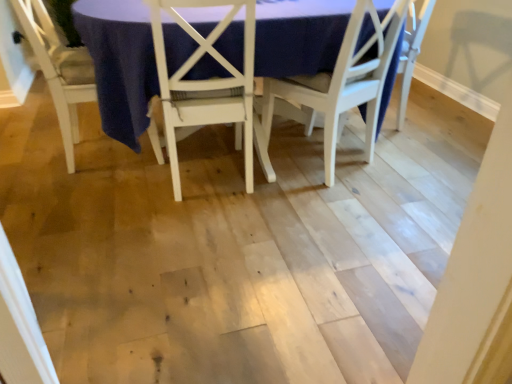
Question: Considering the relative sizes of white wood chair at center, placed as the 3th chair when sorted from left to right, and white wood chair at lower left, which is the 3th chair from right to left, in the image provided, is white wood chair at center, placed as the 3th chair when sorted from left to right, wider than white wood chair at lower left, which is the 3th chair from right to left,?

Choices:
 (A) no
 (B) yes

Answer: (A)

Question: Can you confirm if white wood chair at center, which appears as the 1th chair when viewed from the right, is thinner than white wood chair at lower left, which is the 3th chair from right to left?

Choices:
 (A) no
 (B) yes

Answer: (B)

Question: Does white wood chair at center, placed as the 3th chair when sorted from left to right, have a lesser height compared to white wood chair at lower left, which is the 3th chair from right to left?

Choices:
 (A) yes
 (B) no

Answer: (B)

Question: Is white wood chair at center, which appears as the 1th chair when viewed from the right, outside of white wood chair at lower left, marked as the 1th chair in a left-to-right arrangement?

Choices:
 (A) no
 (B) yes

Answer: (B)

Question: Could you tell me if white wood chair at center, placed as the 3th chair when sorted from left to right, is turned towards white wood chair at lower left, which is the 3th chair from right to left?

Choices:
 (A) no
 (B) yes

Answer: (A)

Question: From the image's perspective, relative to white wood chair at center, which appears as the 1th chair when viewed from the right, is matte white table at center above or below?

Choices:
 (A) below
 (B) above

Answer: (B)

Question: Is point (96, 71) closer or farther from the camera than point (352, 61)?

Choices:
 (A) closer
 (B) farther

Answer: (A)

Question: Is matte white table at center in front of or behind white wood chair at center, placed as the 3th chair when sorted from left to right, in the image?

Choices:
 (A) behind
 (B) front

Answer: (B)

Question: Choose the correct answer: Is matte white table at center inside white wood chair at center, placed as the 3th chair when sorted from left to right, or outside it?

Choices:
 (A) outside
 (B) inside

Answer: (A)

Question: Is white wood chair at center, which is the second chair in right-to-left order, to the left or to the right of white wood chair at lower left, marked as the 1th chair in a left-to-right arrangement, in the image?

Choices:
 (A) left
 (B) right

Answer: (B)

Question: From the image's perspective, is white wood chair at center, which is the second chair in right-to-left order, located above or below white wood chair at lower left, marked as the 1th chair in a left-to-right arrangement?

Choices:
 (A) below
 (B) above

Answer: (A)

Question: From a real-world perspective, is white wood chair at center, the 2th chair in the left-to-right sequence, physically located above or below white wood chair at lower left, which is the 3th chair from right to left?

Choices:
 (A) above
 (B) below

Answer: (A)

Question: In terms of height, does white wood chair at center, the 2th chair in the left-to-right sequence, look taller or shorter compared to white wood chair at lower left, which is the 3th chair from right to left?

Choices:
 (A) tall
 (B) short

Answer: (A)

Question: Is white wood chair at lower left, marked as the 1th chair in a left-to-right arrangement, to the left or to the right of white wood chair at center, placed as the 3th chair when sorted from left to right, in the image?

Choices:
 (A) left
 (B) right

Answer: (A)

Question: Which is correct: white wood chair at lower left, which is the 3th chair from right to left, is inside white wood chair at center, which appears as the 1th chair when viewed from the right, or outside of it?

Choices:
 (A) outside
 (B) inside

Answer: (A)